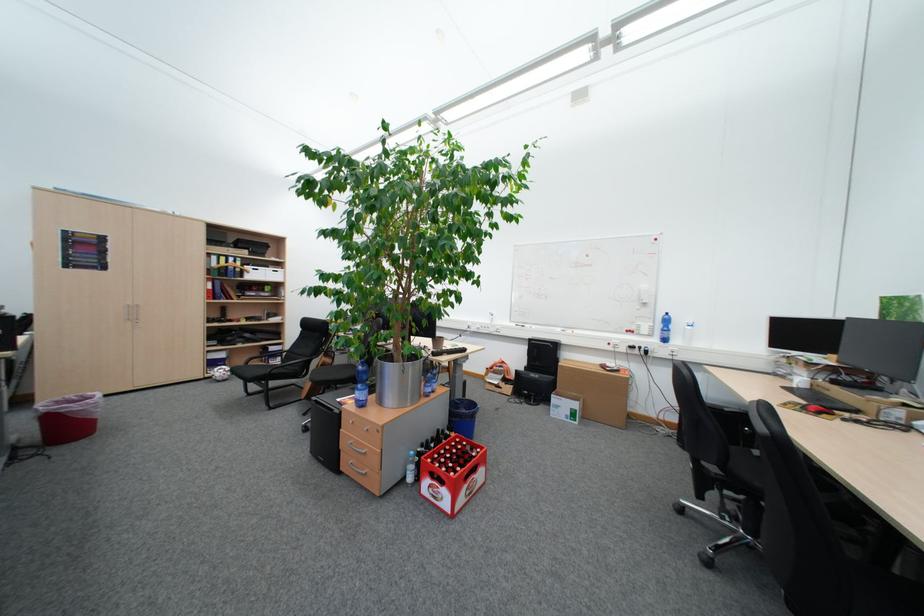
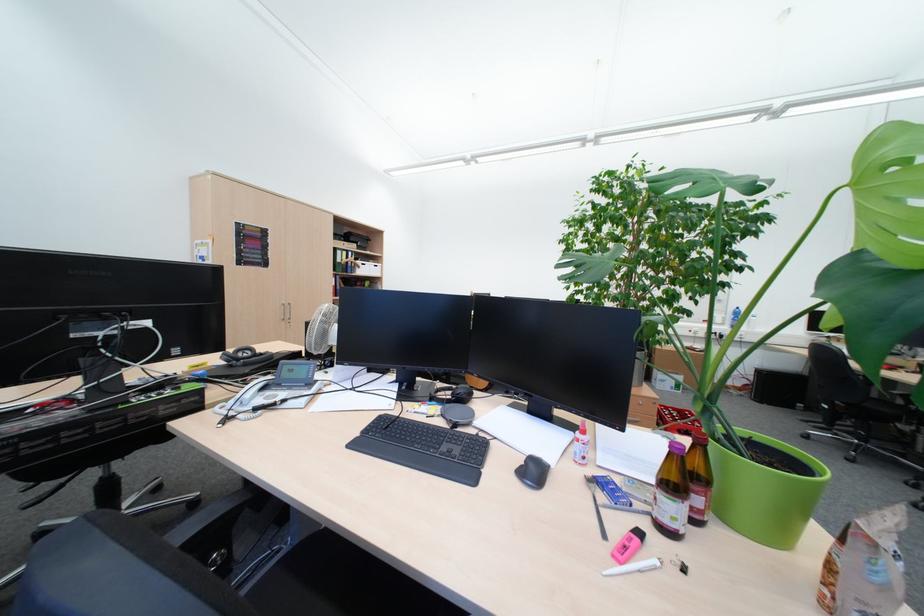
Question: The images are taken continuously from a first-person perspective. In which direction are you moving?

Choices:
 (A) Left
 (B) Right
 (C) Forward
 (D) Backward

Answer: (A)